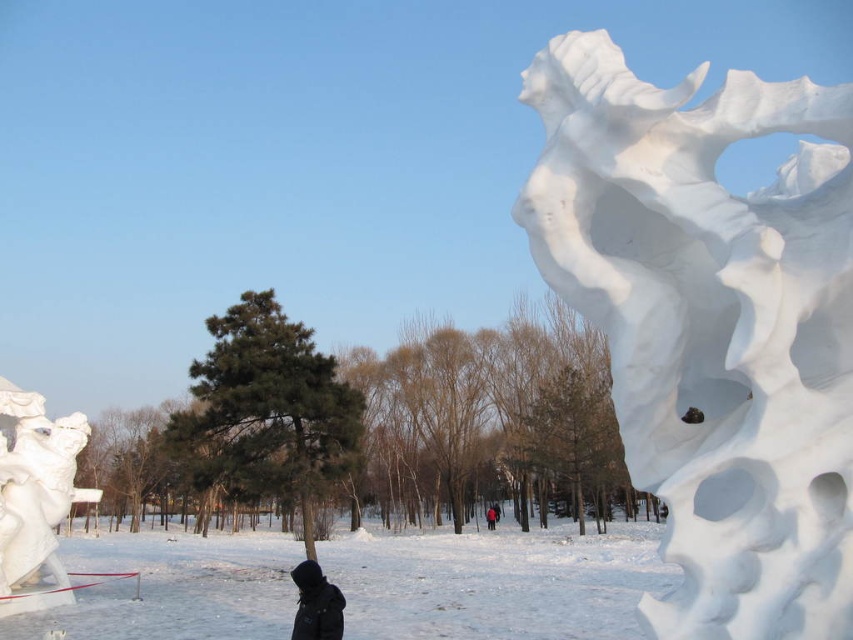
Where is `white glossy statue at lower left`? The height and width of the screenshot is (640, 853). white glossy statue at lower left is located at coordinates (35, 497).

Between point (25, 486) and point (308, 566), which one is positioned in front?

Positioned in front is point (308, 566).

You are a GUI agent. You are given a task and a screenshot of the screen. Output one action in this format:
    pyautogui.click(x=<x>, y=<y>)
    Task: Click on the white glossy statue at lower left
    This screenshot has width=853, height=640.
    Given the screenshot: What is the action you would take?
    pyautogui.click(x=35, y=497)

Where is `white glossy statue at lower left`? This screenshot has width=853, height=640. white glossy statue at lower left is located at coordinates (35, 497).

Which is in front, point (595, 214) or point (10, 552)?

Point (595, 214) is more forward.

Is white snow sculpture at upper right further to camera compared to white glossy statue at lower left?

No, it is in front of white glossy statue at lower left.

The height and width of the screenshot is (640, 853). Describe the element at coordinates (711, 324) in the screenshot. I see `white snow sculpture at upper right` at that location.

What are the coordinates of `white snow sculpture at upper right` in the screenshot? It's located at (711, 324).

Is white snow at lower center taller than white glossy statue at lower left?

Yes.

Does white snow at lower center come in front of white glossy statue at lower left?

Yes, it is in front of white glossy statue at lower left.

Which is behind, point (392, 634) or point (32, 452)?

The point (32, 452) is more distant.

In order to click on white snow at lower center in this screenshot , I will do `click(497, 582)`.